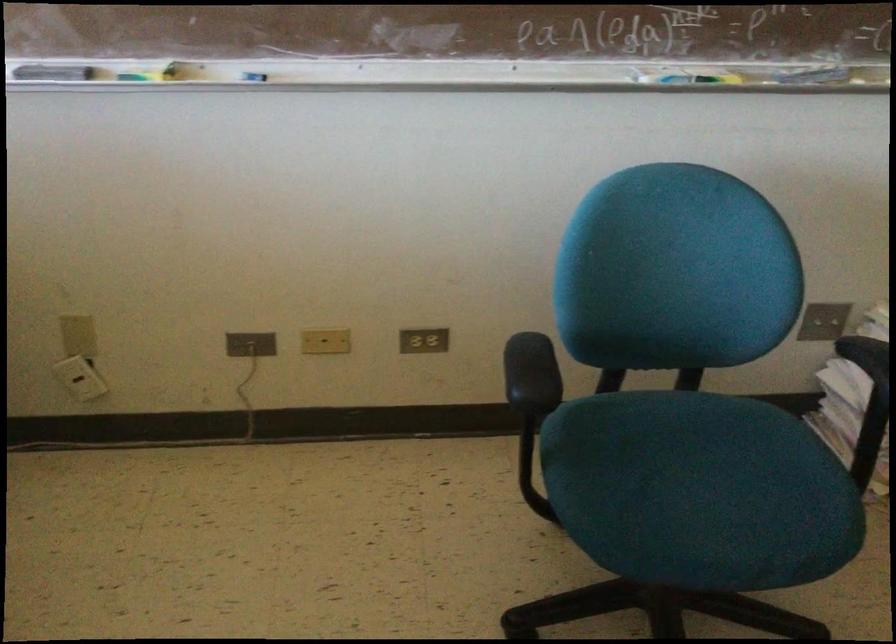
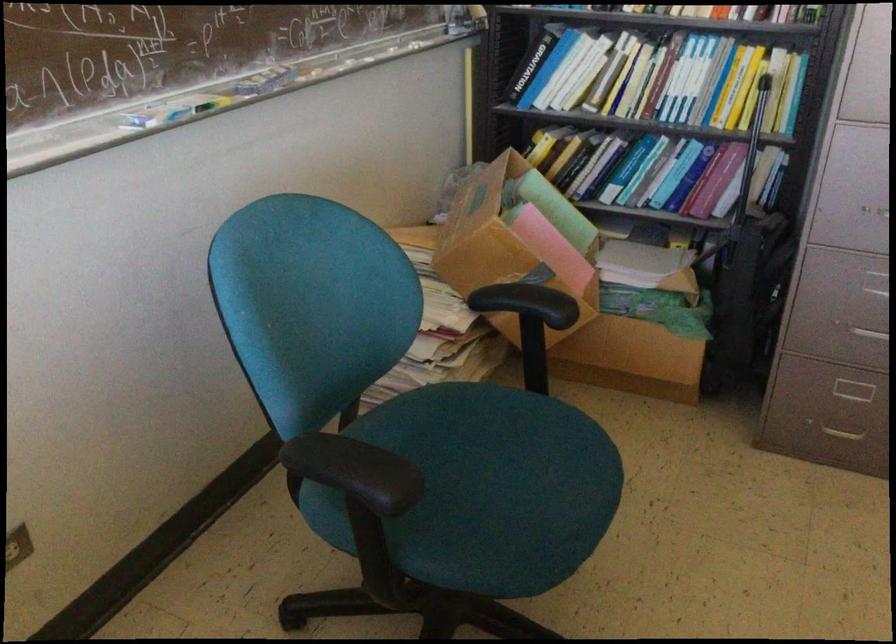
Question: The camera is either moving clockwise (left) or counter-clockwise (right) around the object. The first image is from the beginning of the video and the second image is from the end. Is the camera moving left or right when shooting the video?

Choices:
 (A) Left
 (B) Right

Answer: (A)